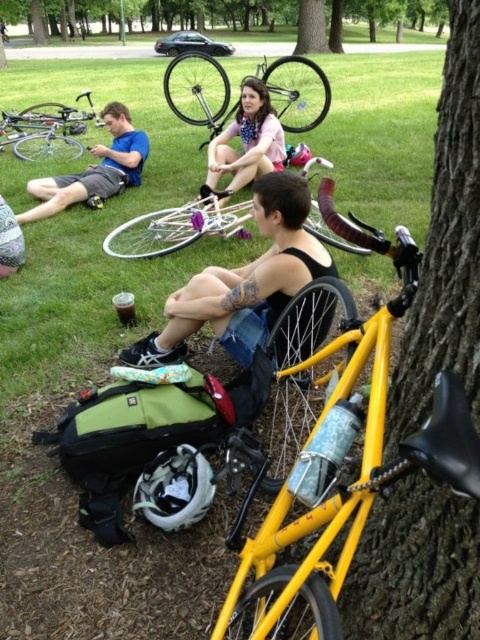
Between yellow metallic bicycle at right and yellow matte bicycle at center, which one appears on the left side from the viewer's perspective?

yellow matte bicycle at center

Is yellow metallic bicycle at right to the right of yellow matte bicycle at center from the viewer's perspective?

Indeed, yellow metallic bicycle at right is positioned on the right side of yellow matte bicycle at center.

Does point (397, 419) lie in front of point (369, 348)?

Yes, it is in front of point (369, 348).

Locate an element on the screen. yellow metallic bicycle at right is located at coordinates (445, 244).

From the picture: Who is higher up, yellow matte bicycle at center or black matte tank top at center?

black matte tank top at center is higher up.

I want to click on yellow matte bicycle at center, so click(x=340, y=468).

Which of these two, green grass at center or black matte tank top at center, stands taller?

green grass at center

Measure the distance from green grass at center to black matte tank top at center.

green grass at center and black matte tank top at center are 4.17 meters apart.

Locate an element on the screen. The width and height of the screenshot is (480, 640). green grass at center is located at coordinates (96, 234).